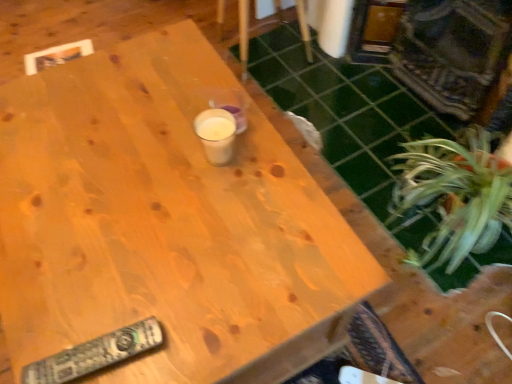
At what (x,y) coordinates should I click in order to perform the action: click on wooden table at center. Please return your answer as a coordinate pair (x, y). This screenshot has width=512, height=384. Looking at the image, I should click on (165, 224).

Measure the distance between point (240, 31) and camera.

Point (240, 31) and camera are 6.39 feet apart.

Identify the location of green leafy plant at lower right. The image size is (512, 384). (454, 196).

I want to click on wooden table at center, so click(x=165, y=224).

Is wooden chair at upper center taller or shorter than green leafy plant at lower right?

Clearly, wooden chair at upper center is taller compared to green leafy plant at lower right.

From a real-world perspective, is wooden chair at upper center physically above green leafy plant at lower right?

Yes, from a real-world perspective, wooden chair at upper center is on top of green leafy plant at lower right.

Is wooden chair at upper center spatially inside green leafy plant at lower right, or outside of it?

wooden chair at upper center cannot be found inside green leafy plant at lower right.

Is point (244, 48) positioned after point (448, 240)?

Yes.

In order to click on table in front of the black plastic remote at lower left in this screenshot , I will do `click(165, 224)`.

From a real-world perspective, is wooden table at center located higher than black plastic remote at lower left?

No, from a real-world perspective, wooden table at center is not over black plastic remote at lower left

How different are the orientations of wooden table at center and black plastic remote at lower left in degrees?

82.8 degrees separate the facing orientations of wooden table at center and black plastic remote at lower left.

From the image's perspective, between wooden table at center and black plastic remote at lower left, which one is located above?

wooden table at center.

Which of these two, black plastic remote at lower left or wooden chair at upper center, is thinner?

black plastic remote at lower left.

Which object is further away from the camera taking this photo, black plastic remote at lower left or wooden chair at upper center?

Positioned behind is wooden chair at upper center.

Where is `remote in front of the wooden chair at upper center`? This screenshot has height=384, width=512. remote in front of the wooden chair at upper center is located at coordinates tap(95, 354).

Is black plastic remote at lower left oriented away from wooden chair at upper center?

That's not correct — black plastic remote at lower left is not looking away from wooden chair at upper center.

Consider the image. Considering the relative sizes of black plastic remote at lower left and wooden table at center in the image provided, is black plastic remote at lower left shorter than wooden table at center?

Indeed, black plastic remote at lower left has a lesser height compared to wooden table at center.

Are black plastic remote at lower left and wooden table at center beside each other?

They are not placed beside each other.

From a real-world perspective, which object stands above the other?

From a 3D spatial view, black plastic remote at lower left is above.

From the image's perspective, relative to wooden table at center, is black plastic remote at lower left above or below?

black plastic remote at lower left is below wooden table at center.

Between wooden table at center and green leafy plant at lower right, which one is positioned in front?

wooden table at center is closer to the camera.

Considering the relative sizes of wooden table at center and green leafy plant at lower right in the image provided, is wooden table at center wider than green leafy plant at lower right?

Indeed, wooden table at center has a greater width compared to green leafy plant at lower right.

Between point (362, 246) and point (469, 170), which one is positioned in front?

The point (362, 246) is more forward.

Which of these two, black plastic remote at lower left or green leafy plant at lower right, stands shorter?

Standing shorter between the two is black plastic remote at lower left.

Considering the relative sizes of black plastic remote at lower left and green leafy plant at lower right in the image provided, is black plastic remote at lower left wider than green leafy plant at lower right?

Correct, the width of black plastic remote at lower left exceeds that of green leafy plant at lower right.

Is there a large distance between black plastic remote at lower left and green leafy plant at lower right?

black plastic remote at lower left is near green leafy plant at lower right, not far away.

Between green leafy plant at lower right and wooden chair at upper center, which one has less height?

green leafy plant at lower right.

Considering their positions, is green leafy plant at lower right located in front of or behind wooden chair at upper center?

In the image, green leafy plant at lower right appears in front of wooden chair at upper center.

Does green leafy plant at lower right appear on the right side of wooden chair at upper center?

Yes, green leafy plant at lower right is to the right of wooden chair at upper center.

The image size is (512, 384). I want to click on houseplant in front of the wooden chair at upper center, so click(454, 196).

Find the location of `table located underneath the black plastic remote at lower left (from a real-world perspective)`. table located underneath the black plastic remote at lower left (from a real-world perspective) is located at coordinates (165, 224).

Considering their positions, is black plastic remote at lower left positioned closer to wooden table at center than green leafy plant at lower right?

black plastic remote at lower left is positioned closer to the anchor wooden table at center.

Looking at this image, looking at the image, which one is located further to wooden chair at upper center, black plastic remote at lower left or wooden table at center?

black plastic remote at lower left is positioned further to the anchor wooden chair at upper center.

From the image, which object appears to be nearer to green leafy plant at lower right, wooden chair at upper center or wooden table at center?

The object closer to green leafy plant at lower right is wooden table at center.

Based on the photo, when comparing their distances from green leafy plant at lower right, does black plastic remote at lower left or wooden chair at upper center seem further?

Among the two, wooden chair at upper center is located further to green leafy plant at lower right.

Which object lies further to the anchor point wooden table at center, green leafy plant at lower right or black plastic remote at lower left?

green leafy plant at lower right.

Which object lies further to the anchor point black plastic remote at lower left, wooden table at center or wooden chair at upper center?

wooden chair at upper center.

When comparing their distances from black plastic remote at lower left, does wooden chair at upper center or wooden table at center seem further?

Based on the image, wooden chair at upper center appears to be further to black plastic remote at lower left.

When comparing their distances from green leafy plant at lower right, does wooden chair at upper center or black plastic remote at lower left seem closer?

black plastic remote at lower left.

At what (x,y) coordinates should I click in order to perform the action: click on houseplant between wooden chair at upper center and wooden table at center vertically. Please return your answer as a coordinate pair (x, y). This screenshot has height=384, width=512. Looking at the image, I should click on (454, 196).

Image resolution: width=512 pixels, height=384 pixels. I want to click on table that lies between wooden chair at upper center and black plastic remote at lower left from top to bottom, so click(165, 224).

I want to click on table between black plastic remote at lower left and green leafy plant at lower right from left to right, so click(x=165, y=224).

This screenshot has height=384, width=512. I want to click on houseplant between wooden chair at upper center and black plastic remote at lower left vertically, so click(x=454, y=196).